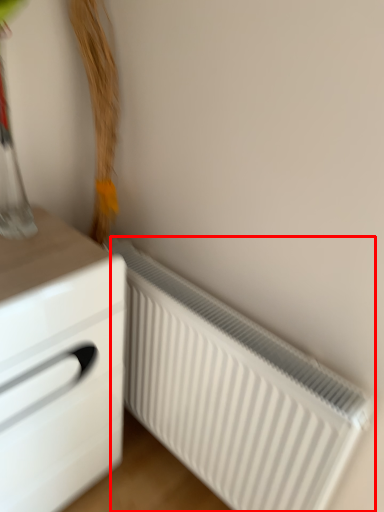
Question: From the image's perspective, what is the correct spatial relationship of radiator (annotated by the red box) in relation to chest of drawers?

Choices:
 (A) below
 (B) above

Answer: (A)